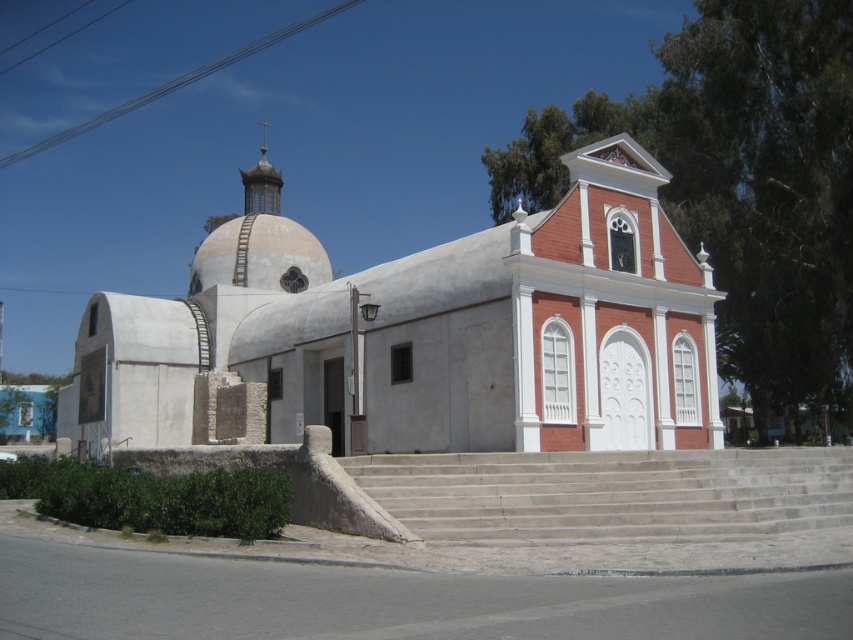
You are standing in front of the church and want to take a photo. You notice two points marked on the church facade at coordinates point (367, 444) and point (722, 509). Which point is closer to your camera when taking the photo?

Point (367, 444) is closer to the camera than point (722, 509) because it is further to the camera than the other point.

You are standing at the entrance of the white stucco chapel at center and want to see the top of the gray concrete stairs at center. Since you can see the entire structure of the chapel, does this mean the chapel is taller than the stairs?

Yes, the white stucco chapel at center is taller than the gray concrete stairs at center according to the description.

You are a delivery person carrying a large package that requires a clear path to the white stucco chapel at center. The gray concrete stairs at center are in the way. Can you move the stairs to make space for the delivery?

The white stucco chapel at center and gray concrete stairs at center are 12.15 meters apart from each other, so there is already enough space between them for the delivery. You do not need to move the stairs.